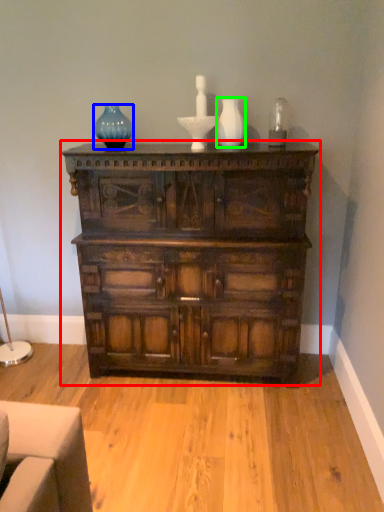
Question: Which object is the closest to the chest of drawers (highlighted by a red box)? Choose among these: glass vase (highlighted by a blue box) or vase (highlighted by a green box).

Choices:
 (A) glass vase
 (B) vase

Answer: (B)